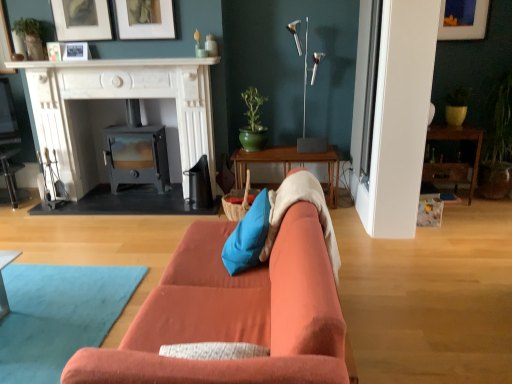
Question: Does white marble fireplace at left have a larger size compared to matte black picture frame at upper left, marked as the third picture frame in a right-to-left arrangement?

Choices:
 (A) yes
 (B) no

Answer: (A)

Question: Considering the relative sizes of white marble fireplace at left and matte black picture frame at upper left, the 3th picture frame when ordered from left to right, in the image provided, is white marble fireplace at left taller than matte black picture frame at upper left, the 3th picture frame when ordered from left to right,?

Choices:
 (A) no
 (B) yes

Answer: (B)

Question: Would you say white marble fireplace at left contains matte black picture frame at upper left, the 3th picture frame when ordered from left to right?

Choices:
 (A) yes
 (B) no

Answer: (B)

Question: Is the depth of white marble fireplace at left greater than that of matte black picture frame at upper left, marked as the third picture frame in a right-to-left arrangement?

Choices:
 (A) no
 (B) yes

Answer: (A)

Question: From the image's perspective, is white marble fireplace at left above matte black picture frame at upper left, the 3th picture frame when ordered from left to right?

Choices:
 (A) yes
 (B) no

Answer: (B)

Question: Is white marble fireplace at left oriented towards matte black picture frame at upper left, the 3th picture frame when ordered from left to right?

Choices:
 (A) yes
 (B) no

Answer: (B)

Question: Considering the relative sizes of matte white picture frame at upper center, positioned as the 2th picture frame in right-to-left order, and metallic gray wood burning stove at center in the image provided, is matte white picture frame at upper center, positioned as the 2th picture frame in right-to-left order, bigger than metallic gray wood burning stove at center?

Choices:
 (A) no
 (B) yes

Answer: (A)

Question: Is matte white picture frame at upper center, positioned as the 2th picture frame in right-to-left order, smaller than metallic gray wood burning stove at center?

Choices:
 (A) yes
 (B) no

Answer: (A)

Question: Does matte white picture frame at upper center, which ranks as the fourth picture frame in left-to-right order, touch metallic gray wood burning stove at center?

Choices:
 (A) no
 (B) yes

Answer: (A)

Question: Can you confirm if matte white picture frame at upper center, which ranks as the fourth picture frame in left-to-right order, is wider than metallic gray wood burning stove at center?

Choices:
 (A) yes
 (B) no

Answer: (B)

Question: Considering the relative sizes of matte white picture frame at upper center, which ranks as the fourth picture frame in left-to-right order, and metallic gray wood burning stove at center in the image provided, is matte white picture frame at upper center, which ranks as the fourth picture frame in left-to-right order, thinner than metallic gray wood burning stove at center?

Choices:
 (A) no
 (B) yes

Answer: (B)

Question: From the image's perspective, is matte white picture frame at upper center, which ranks as the fourth picture frame in left-to-right order, under metallic gray wood burning stove at center?

Choices:
 (A) yes
 (B) no

Answer: (B)

Question: Does matte white picture frame at upper right, which is counted as the fifth picture frame, starting from the left, contain white marble fireplace at upper center?

Choices:
 (A) no
 (B) yes

Answer: (A)